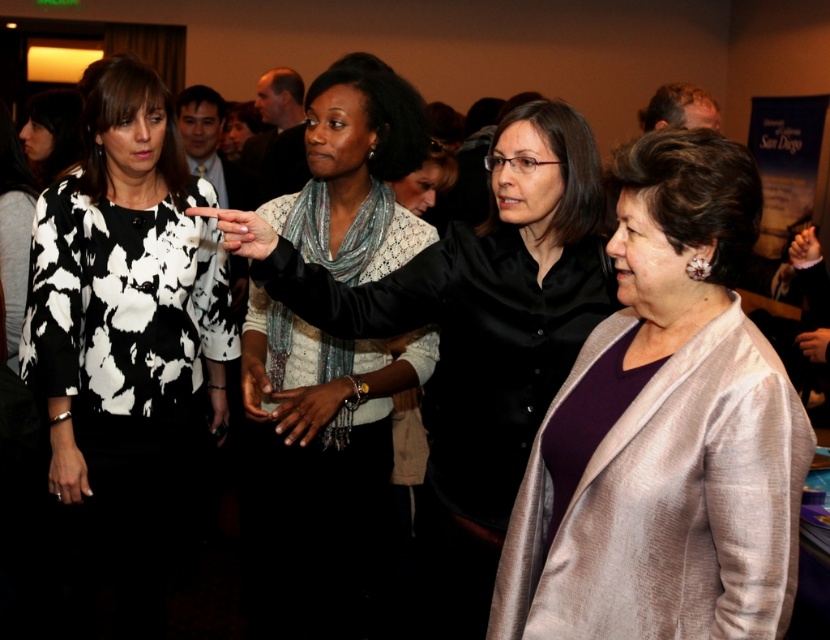
Question: Estimate the real-world distances between objects in this image. Which object is farther from the silky beige coat at center?

Choices:
 (A) white lace blouse at center
 (B) black and white printed blouse at left

Answer: (B)

Question: Where is silky beige coat at center located in relation to white lace blouse at center in the image?

Choices:
 (A) below
 (B) above

Answer: (B)

Question: Which point is closer to the camera taking this photo?

Choices:
 (A) (262, 525)
 (B) (35, 211)

Answer: (B)

Question: Which point appears closest to the camera in this image?

Choices:
 (A) (262, 376)
 (B) (110, 246)

Answer: (A)

Question: Is silky beige coat at center to the right of black and white printed blouse at left from the viewer's perspective?

Choices:
 (A) no
 (B) yes

Answer: (B)

Question: Does silky beige coat at center have a smaller size compared to white lace blouse at center?

Choices:
 (A) yes
 (B) no

Answer: (A)